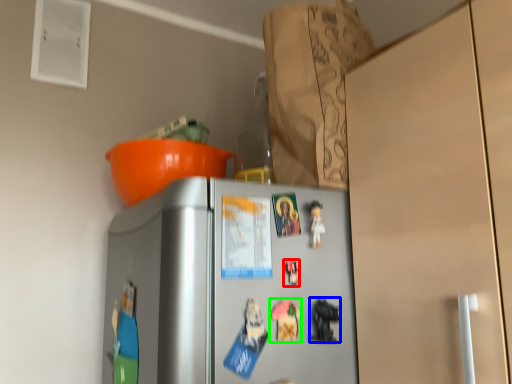
Question: Considering the real-world distances, which object is closest to toy (highlighted by a red box)? toy (highlighted by a blue box) or toy (highlighted by a green box).

Choices:
 (A) toy
 (B) toy

Answer: (B)